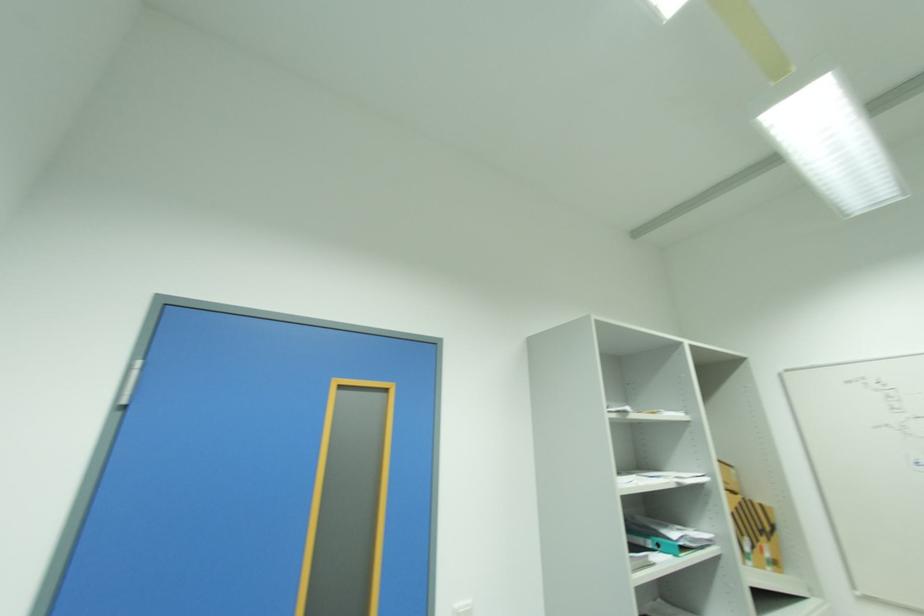
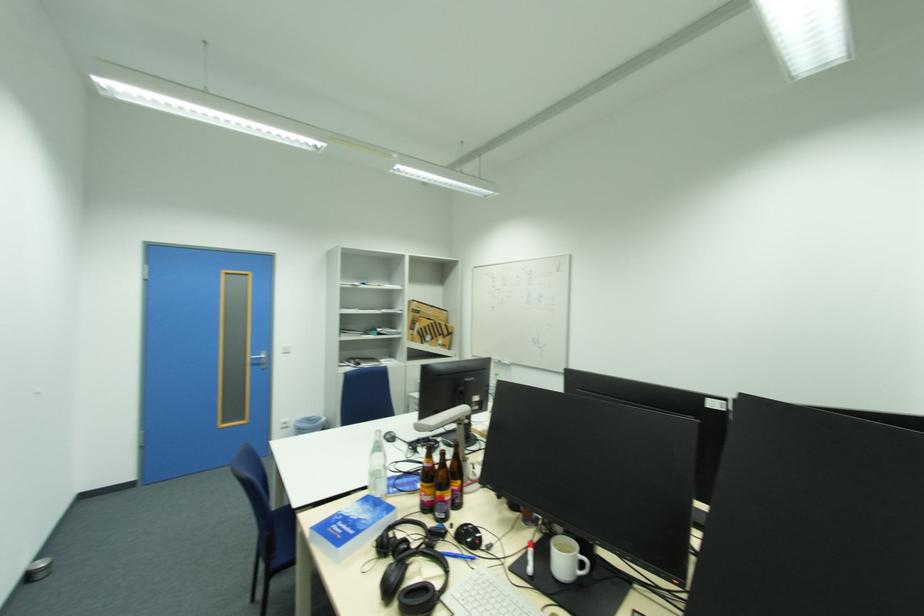
In a continuous first-person perspective shot, in which direction is the camera moving?

The cameraman walked toward right, backward.